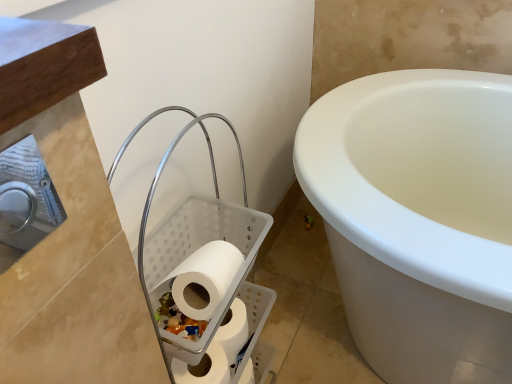
Question: Which direction should I rotate to look at white matte toilet paper at lower center, arranged as the first toilet paper when ordered from the bottom, — up or down?

Choices:
 (A) down
 (B) up

Answer: (A)

Question: From the image's perspective, is white matte toilet paper at lower center, arranged as the 2th toilet paper when viewed from the top, over white plastic laundry basket at upper left?

Choices:
 (A) no
 (B) yes

Answer: (A)

Question: Does white matte toilet paper at lower center, the 2th toilet paper when ordered from bottom to top, have a lesser width compared to white plastic laundry basket at upper left?

Choices:
 (A) yes
 (B) no

Answer: (A)

Question: From a real-world perspective, is white matte toilet paper at lower center, the 2th toilet paper when ordered from bottom to top, located beneath white plastic laundry basket at upper left?

Choices:
 (A) yes
 (B) no

Answer: (A)

Question: From a real-world perspective, is white matte toilet paper at lower center, arranged as the 2th toilet paper when viewed from the top, on top of white plastic laundry basket at upper left?

Choices:
 (A) yes
 (B) no

Answer: (B)

Question: Is white matte toilet paper at lower center, arranged as the 2th toilet paper when viewed from the top, outside white plastic laundry basket at upper left?

Choices:
 (A) yes
 (B) no

Answer: (B)

Question: Is white plastic laundry basket at upper left inside white matte toilet paper at lower center, the 2th toilet paper when ordered from bottom to top?

Choices:
 (A) yes
 (B) no

Answer: (B)

Question: Considering the relative sizes of white plastic laundry basket at upper left and white matte toilet paper at lower center, arranged as the first toilet paper when ordered from the bottom, in the image provided, is white plastic laundry basket at upper left bigger than white matte toilet paper at lower center, arranged as the first toilet paper when ordered from the bottom,?

Choices:
 (A) yes
 (B) no

Answer: (A)

Question: Is white plastic laundry basket at upper left beside white matte toilet paper at lower center, arranged as the first toilet paper when ordered from the bottom?

Choices:
 (A) yes
 (B) no

Answer: (B)

Question: Considering the relative sizes of white plastic laundry basket at upper left and white matte toilet paper at lower center, which appears as the third toilet paper when viewed from the top, in the image provided, is white plastic laundry basket at upper left taller than white matte toilet paper at lower center, which appears as the third toilet paper when viewed from the top,?

Choices:
 (A) yes
 (B) no

Answer: (A)

Question: Does white plastic laundry basket at upper left come behind white matte toilet paper at lower center, arranged as the first toilet paper when ordered from the bottom?

Choices:
 (A) no
 (B) yes

Answer: (A)

Question: Considering the relative sizes of white plastic laundry basket at upper left and white matte toilet paper at lower center, which appears as the third toilet paper when viewed from the top, in the image provided, is white plastic laundry basket at upper left wider than white matte toilet paper at lower center, which appears as the third toilet paper when viewed from the top,?

Choices:
 (A) yes
 (B) no

Answer: (A)

Question: Considering the relative sizes of white plastic laundry basket at upper left and white matte toilet paper at lower center, arranged as the first toilet paper when ordered from the bottom, in the image provided, is white plastic laundry basket at upper left thinner than white matte toilet paper at lower center, arranged as the first toilet paper when ordered from the bottom,?

Choices:
 (A) yes
 (B) no

Answer: (B)

Question: From the image's perspective, is white matte toilet paper at center, placed as the third toilet paper when sorted from bottom to top, located beneath white matte toilet paper at lower center, the 2th toilet paper when ordered from bottom to top?

Choices:
 (A) yes
 (B) no

Answer: (B)